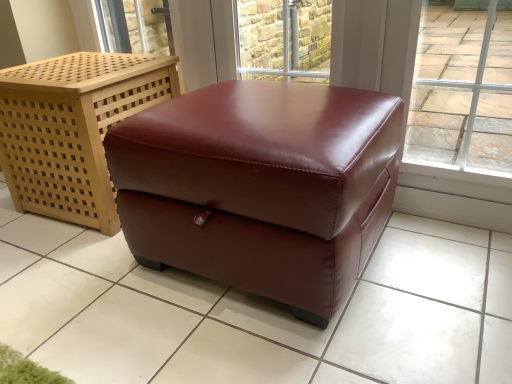
Question: From a real-world perspective, is burgundy leather ottoman at center positioned above or below glossy leather ottoman at center?

Choices:
 (A) below
 (B) above

Answer: (A)

Question: In the image, is burgundy leather ottoman at center positioned in front of or behind glossy leather ottoman at center?

Choices:
 (A) behind
 (B) front

Answer: (A)

Question: Considering the real-world distances, which object is farthest from the burgundy leather ottoman at center?

Choices:
 (A) brick wall at upper center
 (B) glossy leather ottoman at center

Answer: (A)

Question: Considering the real-world distances, which object is farthest from the burgundy leather ottoman at center?

Choices:
 (A) brick wall at upper center
 (B) glossy leather ottoman at center

Answer: (A)